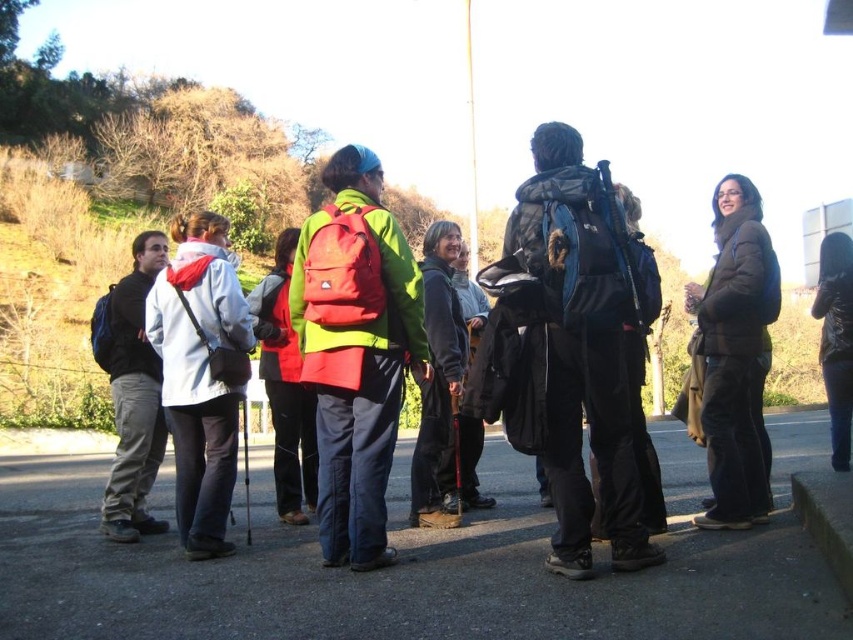
The height and width of the screenshot is (640, 853). What do you see at coordinates (355, 352) in the screenshot? I see `matte green safety vest at center` at bounding box center [355, 352].

Does matte green safety vest at center come in front of red matte backpack at center?

Yes, it is in front of red matte backpack at center.

Does point (390, 548) lie in front of point (276, 372)?

Yes, it is.

You are a GUI agent. You are given a task and a screenshot of the screen. Output one action in this format:
    pyautogui.click(x=<x>, y=<y>)
    Task: Click on the matte green safety vest at center
    The width and height of the screenshot is (853, 640).
    Given the screenshot: What is the action you would take?
    pyautogui.click(x=355, y=352)

You are a GUI agent. You are given a task and a screenshot of the screen. Output one action in this format:
    pyautogui.click(x=<x>, y=<y>)
    Task: Click on the dark blue backpack at center
    
    Given the screenshot: What is the action you would take?
    pyautogui.click(x=582, y=348)

Who is higher up, dark blue backpack at center or matte green safety vest at center?

matte green safety vest at center is higher up.

Does point (579, 416) come closer to viewer compared to point (289, 312)?

That is True.

What are the coordinates of `dark blue backpack at center` in the screenshot? It's located at (582, 348).

Does matte green safety vest at center have a greater width compared to matte black backpack at left?

Yes.

Identify the location of matte green safety vest at center. Image resolution: width=853 pixels, height=640 pixels. (355, 352).